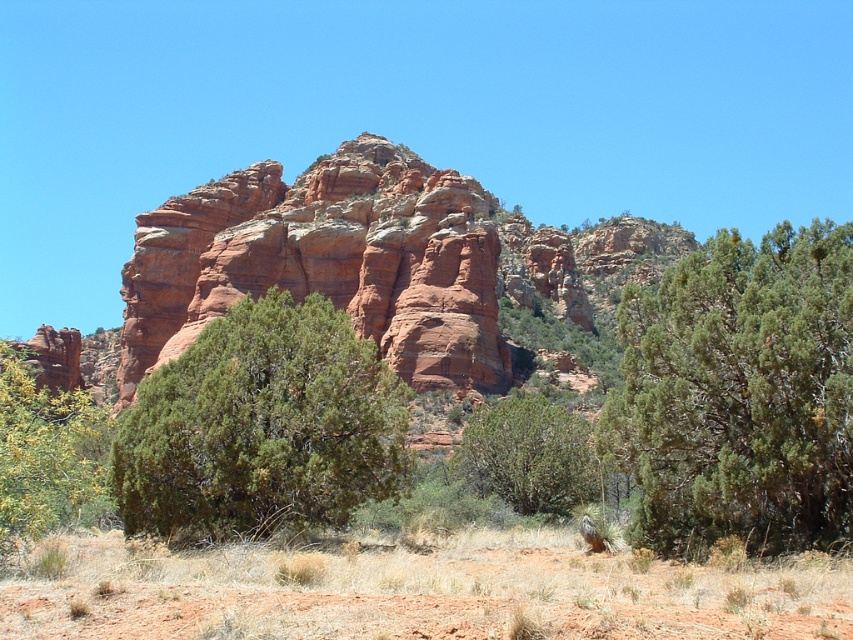
Based on the photo, does dry grass at lower center have a greater width compared to green textured bush at right?

Yes, dry grass at lower center is wider than green textured bush at right.

Who is more forward, (540, 547) or (668, 410)?

Positioned in front is point (668, 410).

Locate an element on the screen. The height and width of the screenshot is (640, 853). dry grass at lower center is located at coordinates (421, 593).

Can you confirm if green textured bush at right is positioned to the right of green textured bush at center?

Yes, green textured bush at right is to the right of green textured bush at center.

Who is taller, green textured bush at right or green textured bush at center?

With more height is green textured bush at right.

What do you see at coordinates (740, 394) in the screenshot? I see `green textured bush at right` at bounding box center [740, 394].

Where is `green textured bush at right`? green textured bush at right is located at coordinates (740, 394).

Is green textured bush at center closer to the viewer compared to green leafy bush at lower left?

No.

Does point (297, 518) lie behind point (84, 460)?

That is True.

Does point (300, 342) come behind point (4, 422)?

Yes, point (300, 342) is behind point (4, 422).

I want to click on green textured bush at center, so click(x=262, y=426).